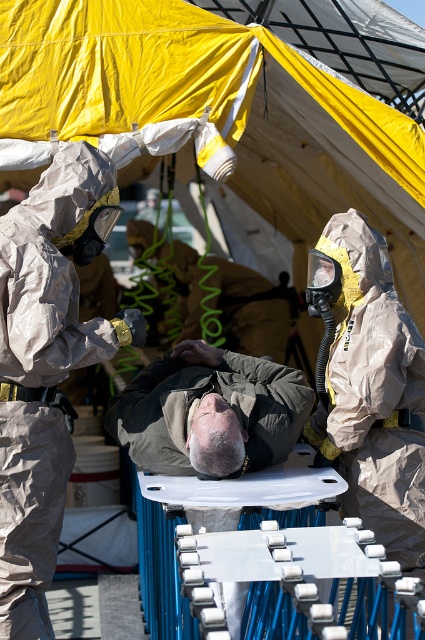
Question: Among these objects, which one is nearest to the camera?

Choices:
 (A) matte gray hazmat suit at left
 (B) matte gray uniform at center

Answer: (A)

Question: Does gray matte uniform at center have a lesser width compared to matte gray uniform at center?

Choices:
 (A) yes
 (B) no

Answer: (A)

Question: Estimate the real-world distances between objects in this image. Which object is closer to the matte gray uniform at center?

Choices:
 (A) matte gray hazmat suit at left
 (B) gray matte uniform at center

Answer: (B)

Question: Is matte gray hazmat suit at left thinner than matte gray uniform at center?

Choices:
 (A) no
 (B) yes

Answer: (B)

Question: Among these objects, which one is nearest to the camera?

Choices:
 (A) matte gray hazmat suit at left
 (B) matte gray uniform at center
 (C) gray matte uniform at center

Answer: (C)

Question: Does matte gray hazmat suit at left appear under gray matte uniform at center?

Choices:
 (A) yes
 (B) no

Answer: (B)